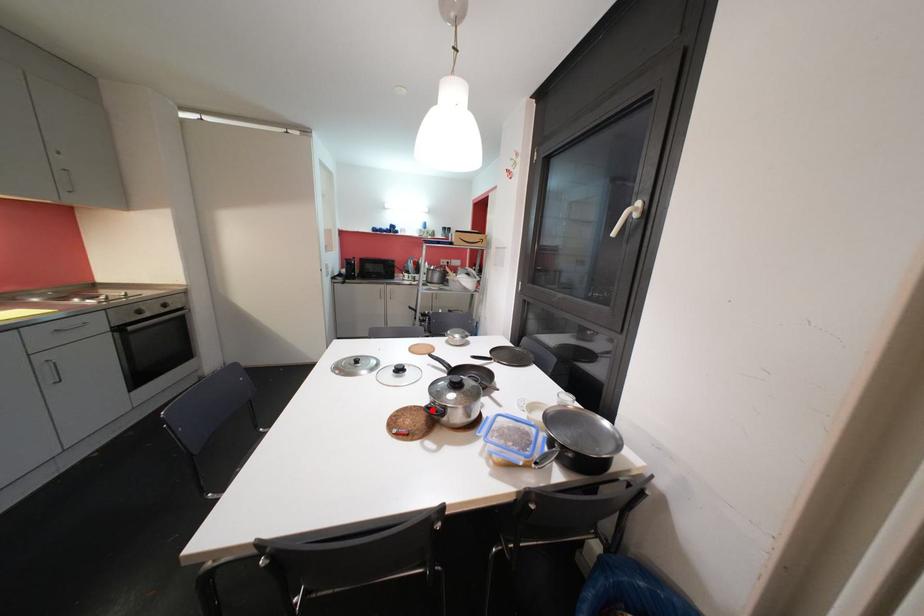
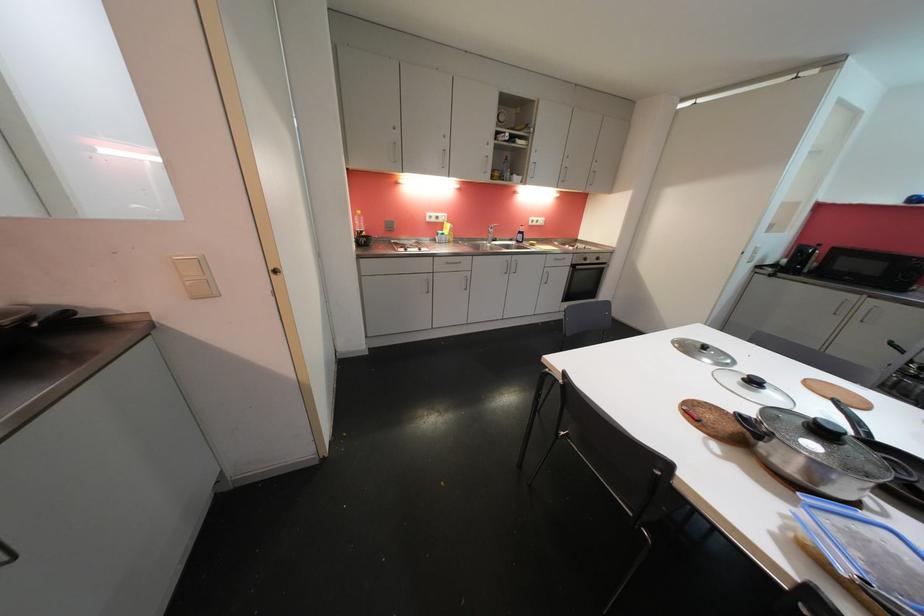
Where in the second image is the point corresponding to the highlighted location from the first image?

(748, 419)